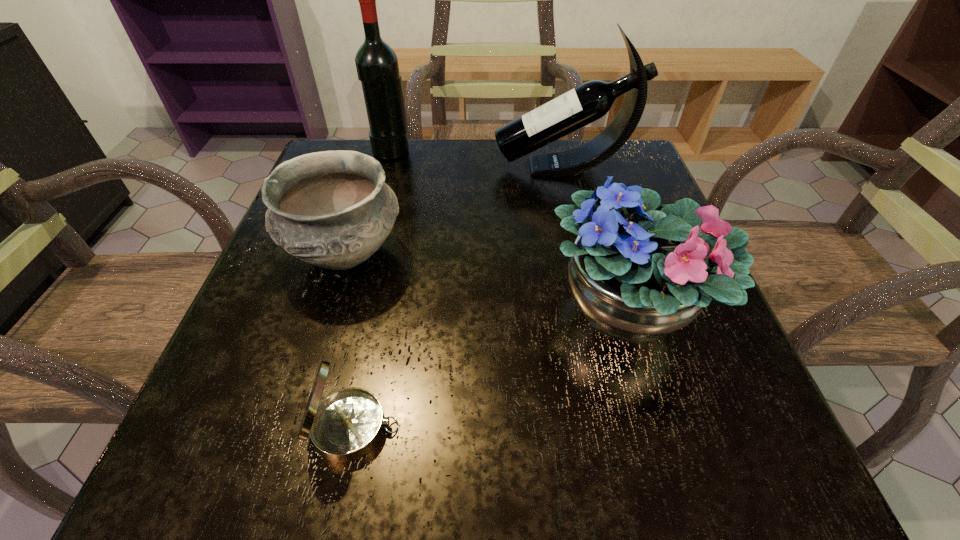
Locate an element on the screen. This screenshot has height=540, width=960. object that is at the far left corner is located at coordinates (377, 67).

At what (x,y) coordinates should I click in order to perform the action: click on object present at the near left corner. Please return your answer as a coordinate pair (x, y). Looking at the image, I should click on (345, 426).

Locate an element on the screen. The width and height of the screenshot is (960, 540). object that is at the far right corner is located at coordinates (590, 101).

In the image, there is a desktop. Where is `vacant region at the far edge`? This screenshot has height=540, width=960. vacant region at the far edge is located at coordinates (401, 190).

Identify the location of free space at the near edge of the desktop. The width and height of the screenshot is (960, 540). (649, 473).

Find the location of a particular element. Image resolution: width=960 pixels, height=540 pixels. free region at the left edge of the desktop is located at coordinates (236, 394).

Where is `free region at the right edge of the desktop`? free region at the right edge of the desktop is located at coordinates [x=742, y=383].

Image resolution: width=960 pixels, height=540 pixels. In the image, there is a desktop. Find the location of `vacant space at the near left corner`. vacant space at the near left corner is located at coordinates (227, 451).

Locate an element on the screen. The image size is (960, 540). vacant space at the far right corner of the desktop is located at coordinates (567, 142).

In the image, there is a desktop. Where is `free space at the near right corner`? free space at the near right corner is located at coordinates pos(668,446).